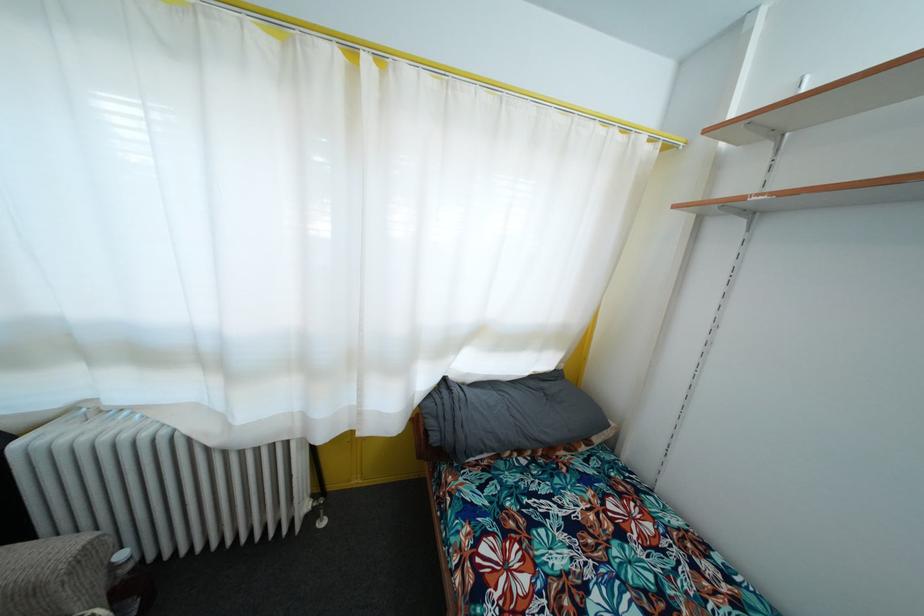
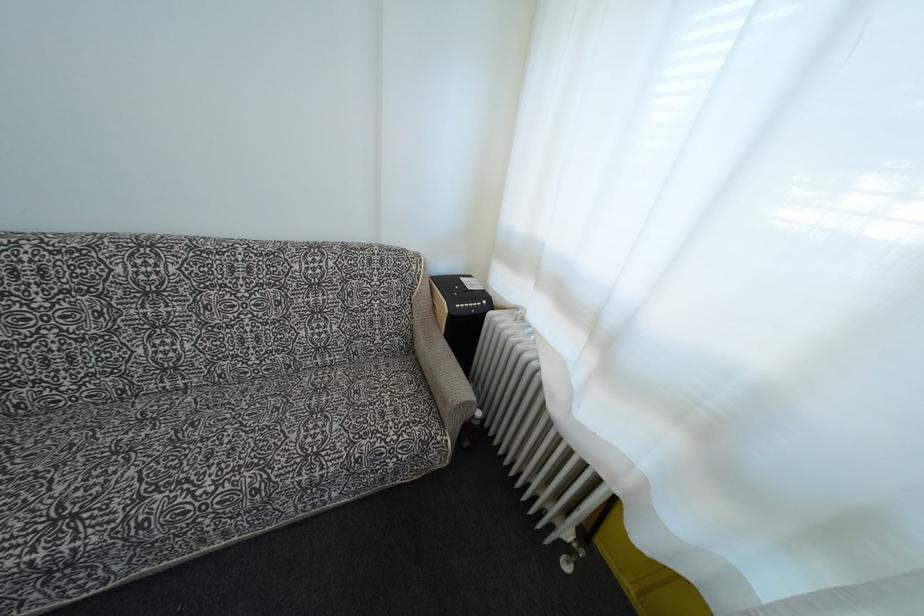
In the second image, find the point that corresponds to (x=132, y=573) in the first image.

(480, 429)